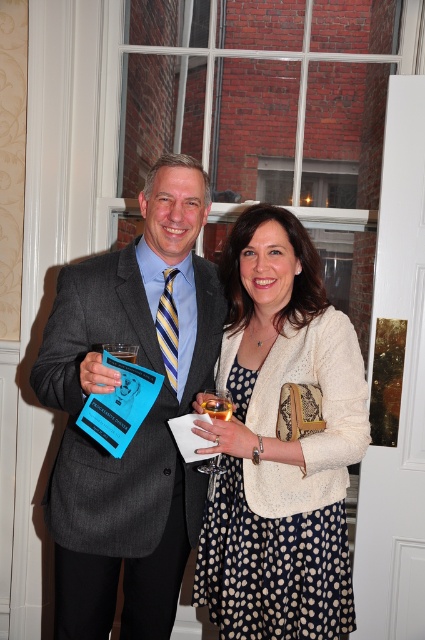
Does white textured sweater at center appear under clear glass wine glass at center?

Incorrect, white textured sweater at center is not positioned below clear glass wine glass at center.

Is point (294, 468) behind point (226, 404)?

That is True.

Which is in front, point (241, 608) or point (226, 390)?

Point (226, 390) is more forward.

This screenshot has height=640, width=425. Find the location of `white textured sweater at center`. white textured sweater at center is located at coordinates (280, 444).

Who is positioned more to the left, gray wool suit at center or white textured sweater at center?

gray wool suit at center is more to the left.

Who is positioned more to the right, gray wool suit at center or white textured sweater at center?

From the viewer's perspective, white textured sweater at center appears more on the right side.

At what (x,y) coordinates should I click in order to perform the action: click on gray wool suit at center. Please return your answer as a coordinate pair (x, y). This screenshot has height=640, width=425. Looking at the image, I should click on (142, 420).

Find the location of a particular element. The height and width of the screenshot is (640, 425). gray wool suit at center is located at coordinates (142, 420).

Which of these two, gray wool suit at center or clear glass wine glass at center, stands shorter?

clear glass wine glass at center

Between gray wool suit at center and clear glass wine glass at center, which one is positioned lower?

clear glass wine glass at center is lower down.

This screenshot has width=425, height=640. Identify the location of gray wool suit at center. (142, 420).